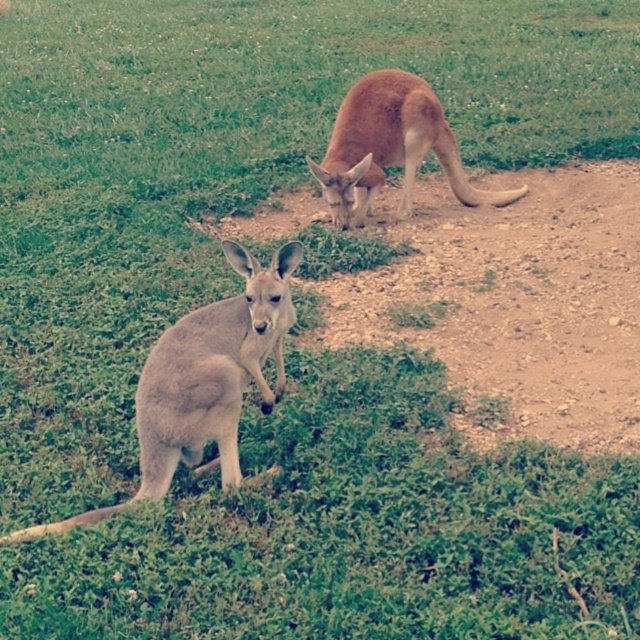
Question: Does light brown fur kangaroo at lower left lie behind brown fur kangaroo at upper center?

Choices:
 (A) yes
 (B) no

Answer: (B)

Question: Does light brown fur kangaroo at lower left appear over brown fur kangaroo at upper center?

Choices:
 (A) yes
 (B) no

Answer: (B)

Question: Among these points, which one is farthest from the camera?

Choices:
 (A) (161, 337)
 (B) (372, 76)

Answer: (B)

Question: Does light brown fur kangaroo at lower left have a greater width compared to brown fur kangaroo at upper center?

Choices:
 (A) no
 (B) yes

Answer: (A)